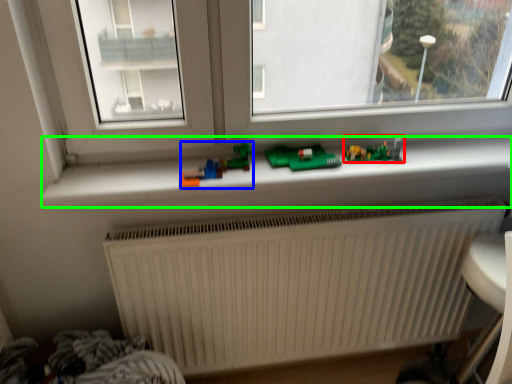
Question: Which object is positioned closest to toy (highlighted by a red box)? Select from toy (highlighted by a blue box) and window sill (highlighted by a green box).

Choices:
 (A) toy
 (B) window sill

Answer: (B)